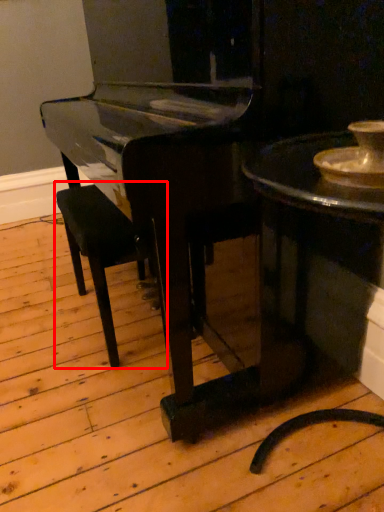
Question: From the image's perspective, where is armchair (annotated by the red box) located relative to table?

Choices:
 (A) above
 (B) below

Answer: (A)